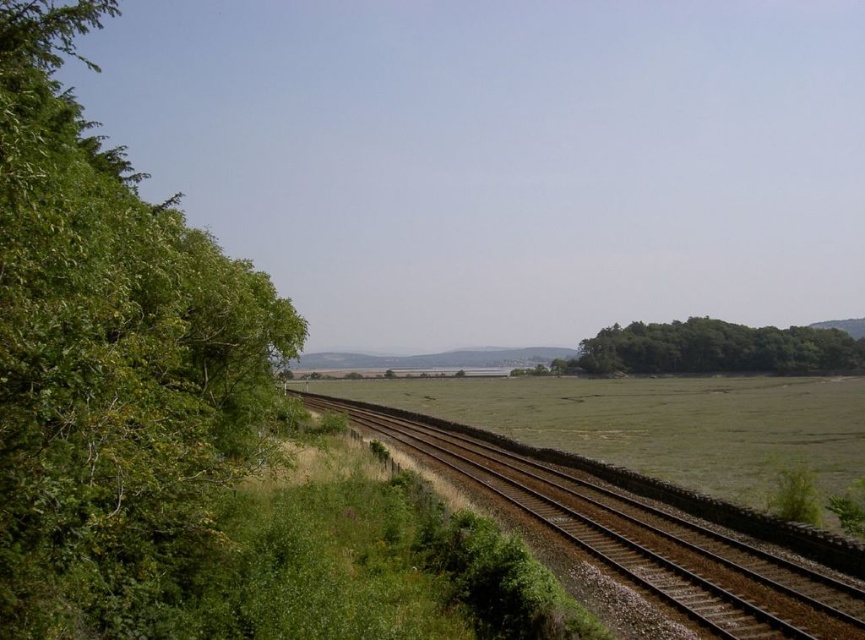
You are standing at point (107,342) in the rural landscape. What is the nearest object to you?

The nearest object to you at point (107,342) is the green leafy tree at left.

You are a hiker planning to cross the brown gravel track at center and the green leafy trees at right. Which one should you approach first if you want to reach the distant hills?

The brown gravel track at center is positioned on the left side of green leafy trees at right, so you should approach the brown gravel track at center first to reach the distant hills.